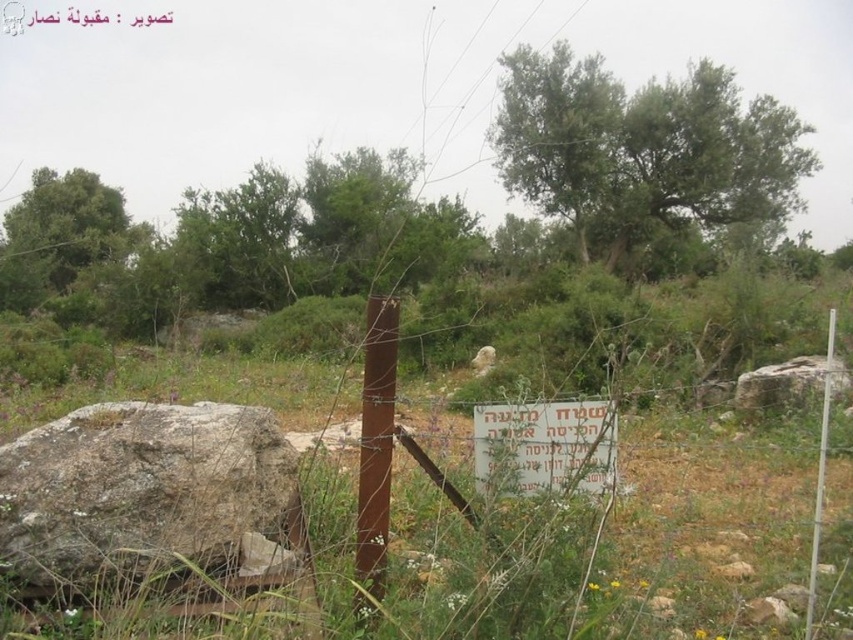
Is gray rough rock at lower left above rusty metal pole at center?

Actually, gray rough rock at lower left is below rusty metal pole at center.

The height and width of the screenshot is (640, 853). What are the coordinates of `gray rough rock at lower left` in the screenshot? It's located at (143, 490).

Based on the photo, can you confirm if gray rough rock at lower left is smaller than white plastic sign at center?

No, gray rough rock at lower left is not smaller than white plastic sign at center.

Looking at this image, between gray rough rock at lower left and white plastic sign at center, which one has more height?

Standing taller between the two is gray rough rock at lower left.

I want to click on gray rough rock at lower left, so click(143, 490).

At what (x,y) coordinates should I click in order to perform the action: click on gray rough rock at lower left. Please return your answer as a coordinate pair (x, y). Looking at the image, I should click on (143, 490).

Can you confirm if gray rough rock at lower left is shorter than white plastic pole at right?

Yes.

Does point (158, 404) come in front of point (813, 588)?

That is False.

You are a GUI agent. You are given a task and a screenshot of the screen. Output one action in this format:
    pyautogui.click(x=<x>, y=<y>)
    Task: Click on the gray rough rock at lower left
    The height and width of the screenshot is (640, 853).
    Given the screenshot: What is the action you would take?
    pyautogui.click(x=143, y=490)